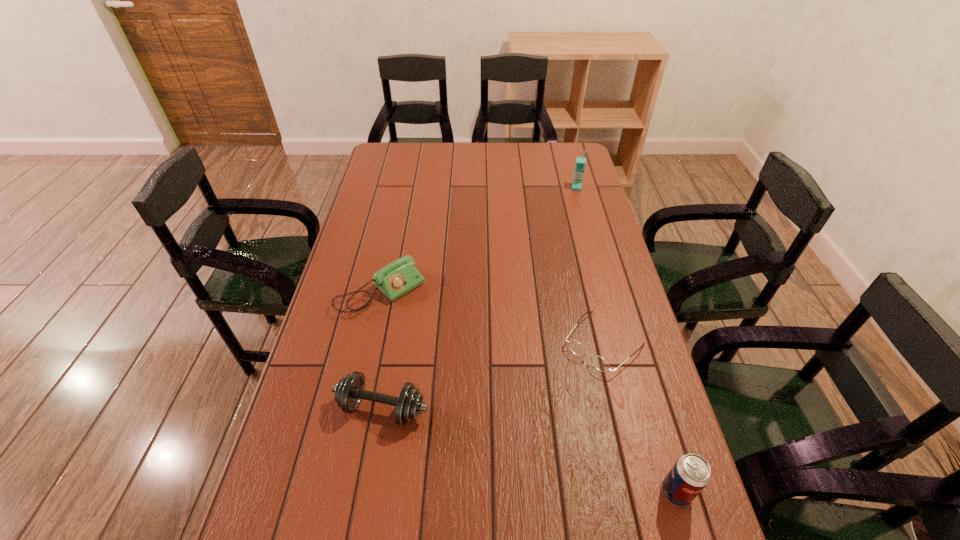
In the image, there is a desktop. In order to click on blank space at the far left corner in this screenshot , I will do `click(389, 153)`.

Locate an element on the screen. This screenshot has height=540, width=960. blank space at the far right corner of the desktop is located at coordinates pyautogui.click(x=552, y=158).

At what (x,y) coordinates should I click in order to perform the action: click on vacant space in between the spectacles and the nearest object. Please return your answer as a coordinate pair (x, y). The image size is (960, 540). Looking at the image, I should click on (640, 417).

Where is `vacant point located between the dumbbell and the telephone`? The height and width of the screenshot is (540, 960). vacant point located between the dumbbell and the telephone is located at coordinates (382, 350).

The width and height of the screenshot is (960, 540). I want to click on free space between the beer can and the shortest object, so click(640, 417).

Where is `vacant region between the nearest object and the shortest object`? vacant region between the nearest object and the shortest object is located at coordinates (640, 417).

Find the location of `free space between the shortest object and the second tallest object`. free space between the shortest object and the second tallest object is located at coordinates (640, 417).

What are the coordinates of `free space between the telephone and the shortest object` in the screenshot? It's located at (492, 317).

Locate an element on the screen. The width and height of the screenshot is (960, 540). empty space that is in between the shortest object and the beer can is located at coordinates (640, 417).

You are a GUI agent. You are given a task and a screenshot of the screen. Output one action in this format:
    pyautogui.click(x=<x>, y=<y>)
    Task: Click on the free point between the second nearest object and the fourth tallest object
    
    Given the screenshot: What is the action you would take?
    pyautogui.click(x=382, y=350)